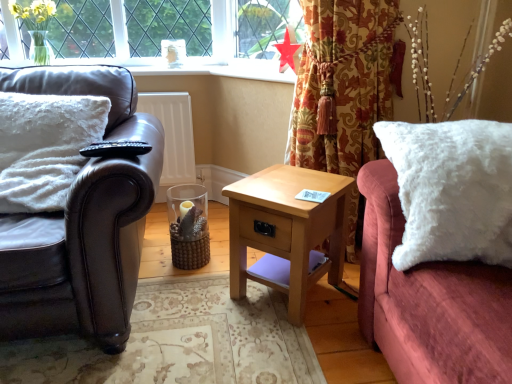
Question: Is light wood/texture nightstand at center wider than leather couch at left?

Choices:
 (A) yes
 (B) no

Answer: (B)

Question: Is light wood/texture nightstand at center completely or partially outside of leather couch at left?

Choices:
 (A) yes
 (B) no

Answer: (A)

Question: Is light wood/texture nightstand at center looking in the opposite direction of leather couch at left?

Choices:
 (A) yes
 (B) no

Answer: (B)

Question: Is light wood/texture nightstand at center further to the viewer compared to leather couch at left?

Choices:
 (A) no
 (B) yes

Answer: (B)

Question: Is light wood/texture nightstand at center directly adjacent to leather couch at left?

Choices:
 (A) no
 (B) yes

Answer: (A)

Question: Would you say light wood/texture nightstand at center contains leather couch at left?

Choices:
 (A) yes
 (B) no

Answer: (B)

Question: From a real-world perspective, is red paper star at upper center beneath floral fabric curtain at upper right?

Choices:
 (A) no
 (B) yes

Answer: (A)

Question: Considering the relative sizes of red paper star at upper center and floral fabric curtain at upper right in the image provided, is red paper star at upper center smaller than floral fabric curtain at upper right?

Choices:
 (A) yes
 (B) no

Answer: (A)

Question: Considering the relative sizes of red paper star at upper center and floral fabric curtain at upper right in the image provided, is red paper star at upper center shorter than floral fabric curtain at upper right?

Choices:
 (A) yes
 (B) no

Answer: (A)

Question: Is red paper star at upper center behind floral fabric curtain at upper right?

Choices:
 (A) yes
 (B) no

Answer: (A)

Question: Can you confirm if red paper star at upper center is thinner than floral fabric curtain at upper right?

Choices:
 (A) no
 (B) yes

Answer: (B)

Question: Can you confirm if red paper star at upper center is positioned to the right of floral fabric curtain at upper right?

Choices:
 (A) yes
 (B) no

Answer: (B)

Question: Does leather couch at left have a larger size compared to light wood/texture nightstand at center?

Choices:
 (A) no
 (B) yes

Answer: (B)